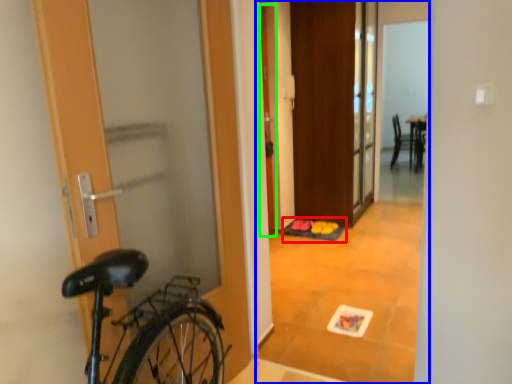
Question: Considering the real-world distances, which object is closest to doormat (highlighted by a red box)? corridor (highlighted by a blue box) or door (highlighted by a green box).

Choices:
 (A) corridor
 (B) door

Answer: (B)